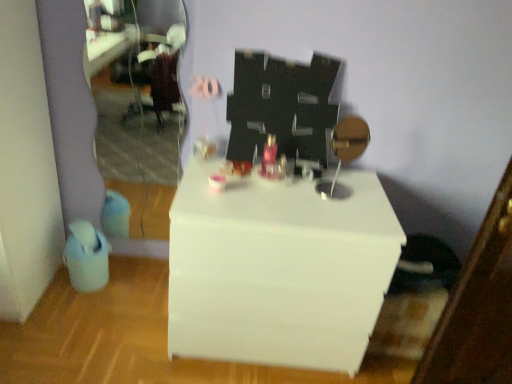
Question: From the image's perspective, is clear glass mirror at left above or below white glossy table at center?

Choices:
 (A) below
 (B) above

Answer: (B)

Question: In terms of size, does clear glass mirror at left appear bigger or smaller than white glossy table at center?

Choices:
 (A) small
 (B) big

Answer: (A)

Question: From a real-world perspective, relative to white glossy table at center, is clear glass mirror at left vertically above or below?

Choices:
 (A) above
 (B) below

Answer: (A)

Question: Considering the relative positions of white glossy table at center and clear glass mirror at left in the image provided, is white glossy table at center to the left or to the right of clear glass mirror at left?

Choices:
 (A) right
 (B) left

Answer: (A)

Question: From their relative heights in the image, would you say white glossy table at center is taller or shorter than clear glass mirror at left?

Choices:
 (A) short
 (B) tall

Answer: (A)

Question: From a real-world perspective, relative to clear glass mirror at left, is white glossy table at center vertically above or below?

Choices:
 (A) above
 (B) below

Answer: (B)

Question: From the image's perspective, relative to clear glass mirror at left, is white glossy table at center above or below?

Choices:
 (A) below
 (B) above

Answer: (A)